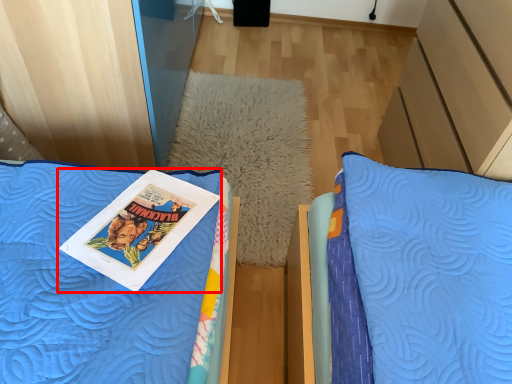
Question: In this image, where is book (annotated by the red box) located relative to pillow?

Choices:
 (A) right
 (B) left

Answer: (B)